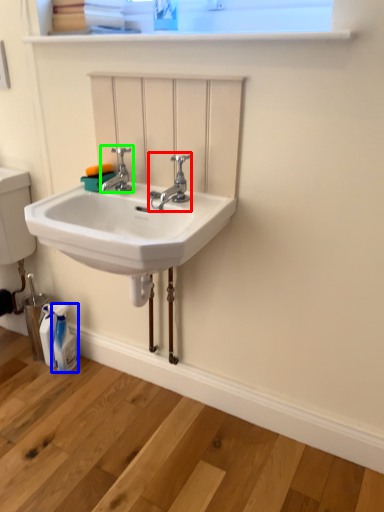
Question: Considering the real-world distances, which object is closest to tap (highlighted by a red box)? toiletry (highlighted by a blue box) or tap (highlighted by a green box).

Choices:
 (A) toiletry
 (B) tap

Answer: (B)